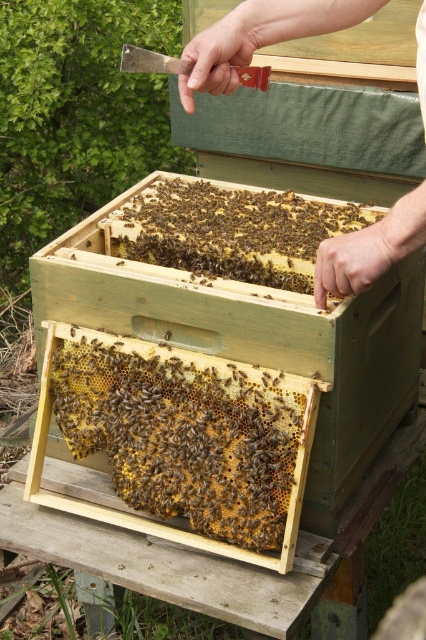
You are a beekeeper trying to access the honeycomb inside the wooden beehive at center. You notice the smooth wooden hive at center above it. Which hive should you lift first to reach the honeycomb?

The wooden beehive at center must be lifted first because it is positioned under the smooth wooden hive at center, so lifting the lower one first would allow access to the honeycomb.

You are a beekeeper trying to determine the placement of the brown wax comb at center and the smooth wooden hive at center. Which object is shorter in height?

The brown wax comb at center is shorter in height compared to the smooth wooden hive at center.